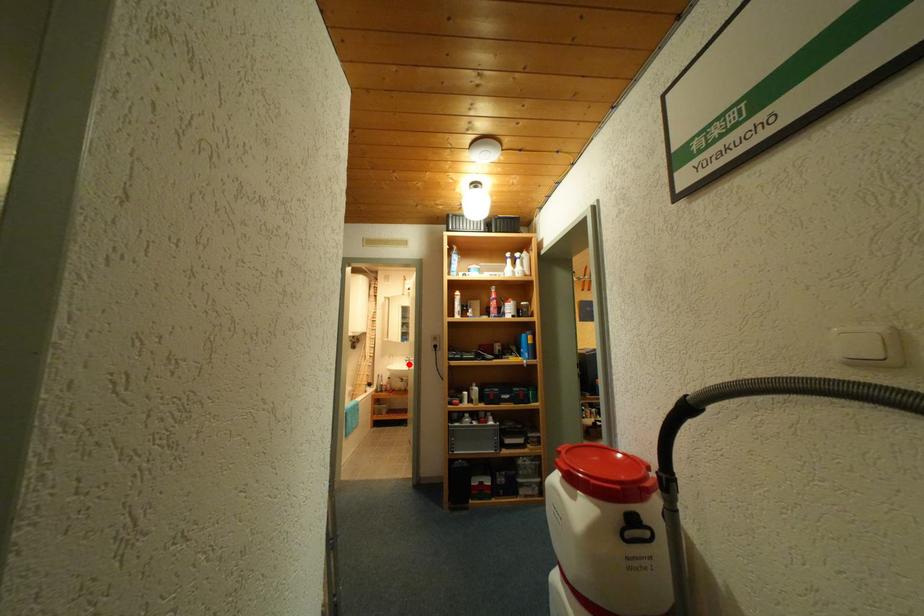
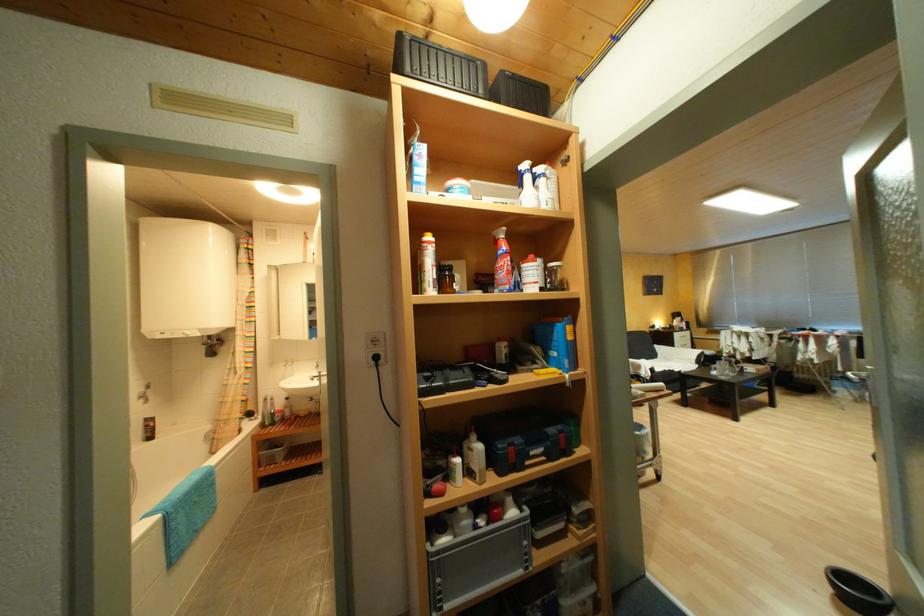
Find the pixel in the second image that matches the highlighted location in the first image.

(312, 378)